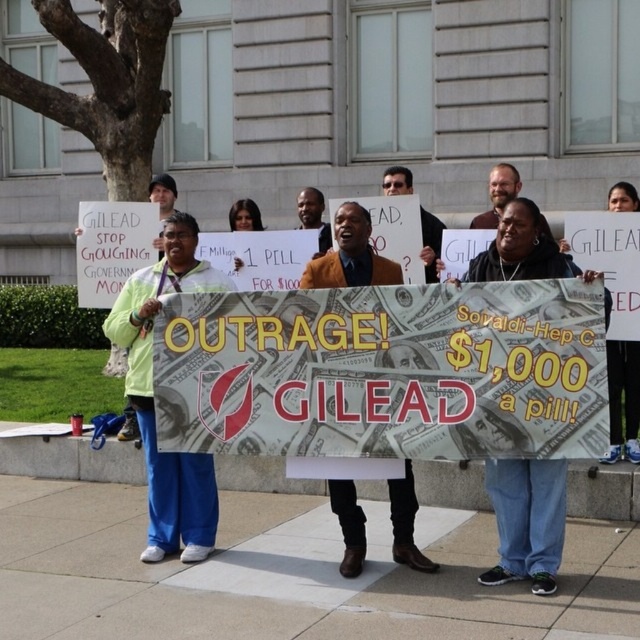
Does matte brown shirt at center appear on the left side of smooth brown skin at center?

Incorrect, matte brown shirt at center is not on the left side of smooth brown skin at center.

Does matte brown shirt at center have a lesser width compared to smooth brown skin at center?

In fact, matte brown shirt at center might be wider than smooth brown skin at center.

Between point (420, 228) and point (321, 196), which one is positioned in front?

Point (420, 228)

You are a GUI agent. You are given a task and a screenshot of the screen. Output one action in this format:
    pyautogui.click(x=<x>, y=<y>)
    Task: Click on the matte brown shirt at center
    The height and width of the screenshot is (640, 640).
    Given the screenshot: What is the action you would take?
    pyautogui.click(x=429, y=243)

Is matte brown shirt at center further to camera compared to bearded man at center?

Yes, it is.

Who is positioned more to the right, matte brown shirt at center or bearded man at center?

From the viewer's perspective, bearded man at center appears more on the right side.

Between point (403, 177) and point (518, 180), which one is positioned behind?

The point (403, 177) is more distant.

Find the location of a particular element. The width and height of the screenshot is (640, 640). matte brown shirt at center is located at coordinates (429, 243).

Can you confirm if light green fabric pants at center is smaller than bearded man at center?

No, light green fabric pants at center is not smaller than bearded man at center.

This screenshot has width=640, height=640. What do you see at coordinates (152, 397) in the screenshot? I see `light green fabric pants at center` at bounding box center [152, 397].

You are a GUI agent. You are given a task and a screenshot of the screen. Output one action in this format:
    pyautogui.click(x=<x>, y=<y>)
    Task: Click on the light green fabric pants at center
    The image size is (640, 640).
    Given the screenshot: What is the action you would take?
    pyautogui.click(x=152, y=397)